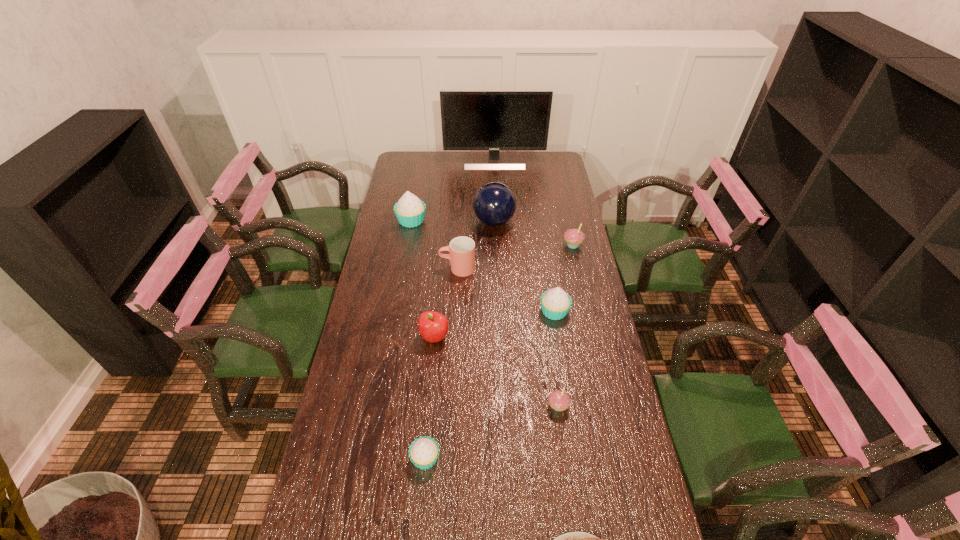
Select which white cupcake is the second closest to the second tallest object. Please provide its 2D coordinates. Your answer should be formatted as a tuple, i.e. [(x, y)], where the tuple contains the x and y coordinates of a point satisfying the conditions above.

[(555, 303)]

Locate an element on the screen. white cupcake that stands as the third closest to the ninth shortest object is located at coordinates (424, 451).

Locate an element on the screen. The image size is (960, 540). vacant space that satisfies the following two spatial constraints: 1. on the surface of the bowling ball near the finger holes; 2. on the left side of the fourth farthest object is located at coordinates pos(495,245).

This screenshot has width=960, height=540. Identify the location of free space in the image that satisfies the following two spatial constraints: 1. on the screen side of the farthest object; 2. on the right side of the left pink cupcake. (505, 406).

Locate an element on the screen. vacant space that satisfies the following two spatial constraints: 1. on the back side of the left pink cupcake; 2. on the left side of the third farthest cupcake is located at coordinates (545, 311).

Image resolution: width=960 pixels, height=540 pixels. Find the location of `vacant space that satisfies the following two spatial constraints: 1. on the back side of the third nearest object; 2. on the right side of the seventh nearest object`. vacant space that satisfies the following two spatial constraints: 1. on the back side of the third nearest object; 2. on the right side of the seventh nearest object is located at coordinates (536, 245).